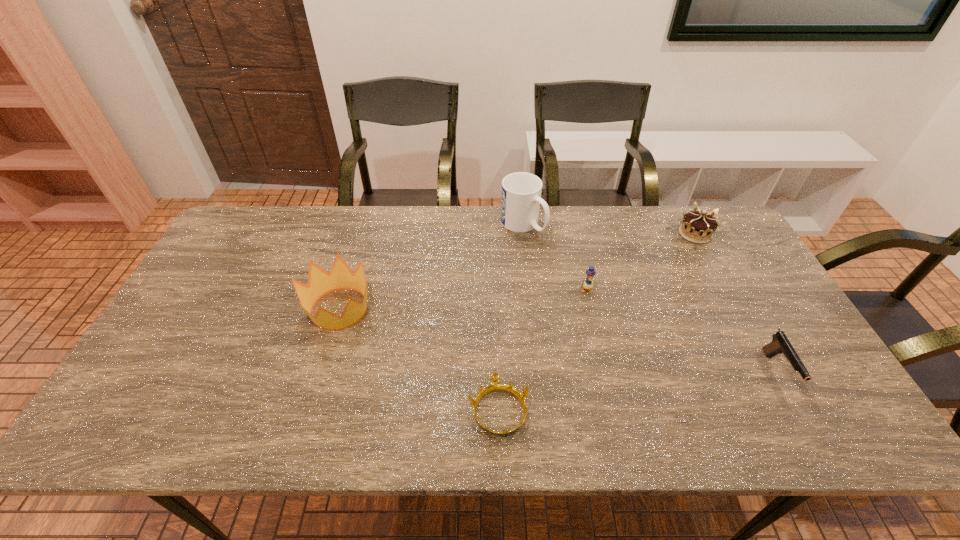
Identify the location of object that is at the far right corner. (x=698, y=226).

I want to click on vacant space at the far edge of the desktop, so click(x=606, y=225).

What are the coordinates of `free space at the left edge` in the screenshot? It's located at (217, 334).

Image resolution: width=960 pixels, height=540 pixels. In the image, there is a desktop. Identify the location of free space at the right edge. (720, 282).

At what (x,y) coordinates should I click in order to perform the action: click on vacant region at the far left corner. Please return your answer as a coordinate pair (x, y). Looking at the image, I should click on (234, 226).

Identify the location of free space at the near right corner. The image size is (960, 540). (787, 432).

The image size is (960, 540). In order to click on unoccupied position between the pistol and the second crown from right to left in this screenshot , I will do `click(638, 391)`.

What are the coordinates of `blank region between the tallest object and the shortest object` in the screenshot? It's located at pyautogui.click(x=511, y=318).

Where is `free space between the tallest object and the nearest crown`? This screenshot has height=540, width=960. free space between the tallest object and the nearest crown is located at coordinates coord(511,318).

Locate an element on the screen. free area in between the rightmost crown and the tallest object is located at coordinates (609, 229).